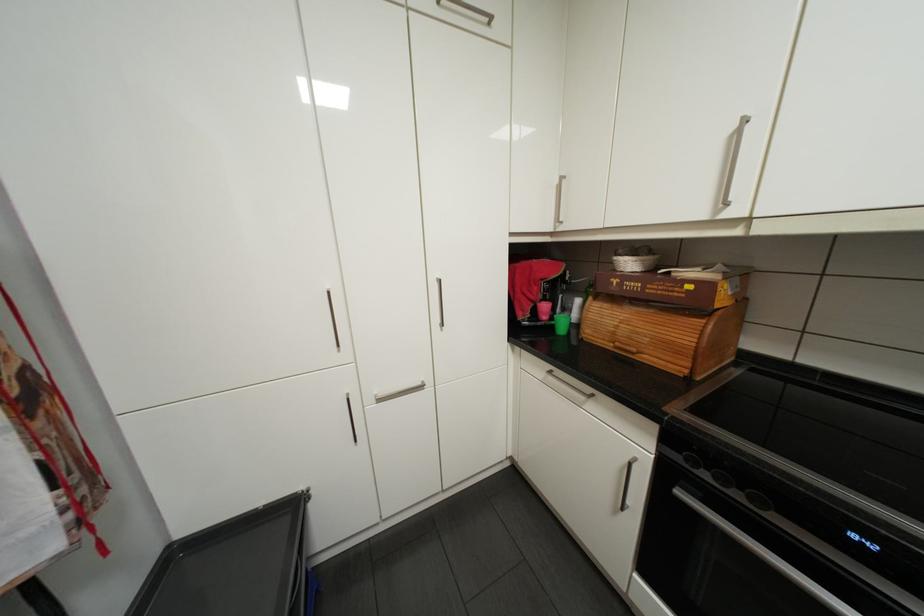
At what (x,y) coordinates should I click in order to perform the action: click on brown cardboard box. Please return your answer as a coordinate pair (x, y). Looking at the image, I should click on (706, 284).